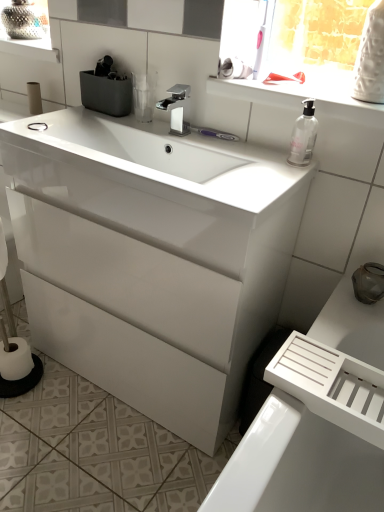
Locate an element on the screen. Image resolution: width=384 pixels, height=512 pixels. vacant region in front of white glossy cabinet at center is located at coordinates (x=103, y=453).